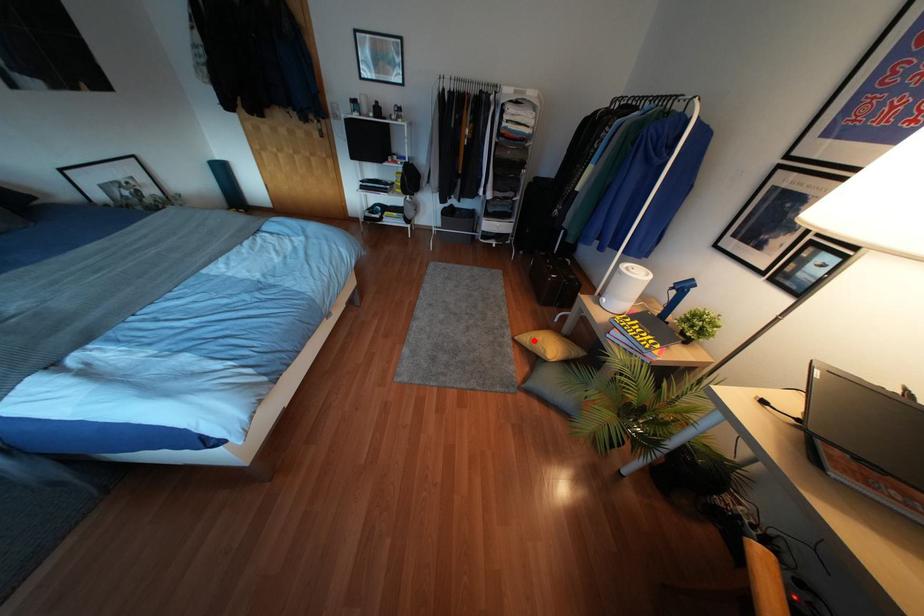
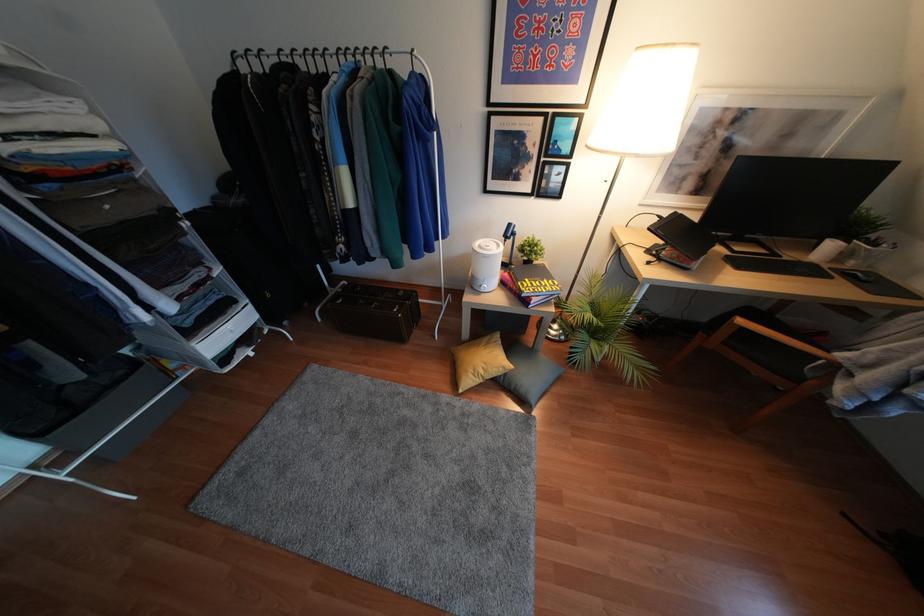
Locate, in the second image, the point that corresponds to the highlighted location in the first image.

(480, 371)